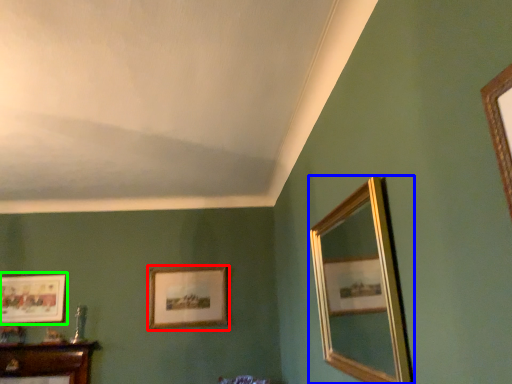
Question: Which is farther away from picture frame (highlighted by a red box)? mirror (highlighted by a blue box) or picture frame (highlighted by a green box)?

Choices:
 (A) mirror
 (B) picture frame

Answer: (A)